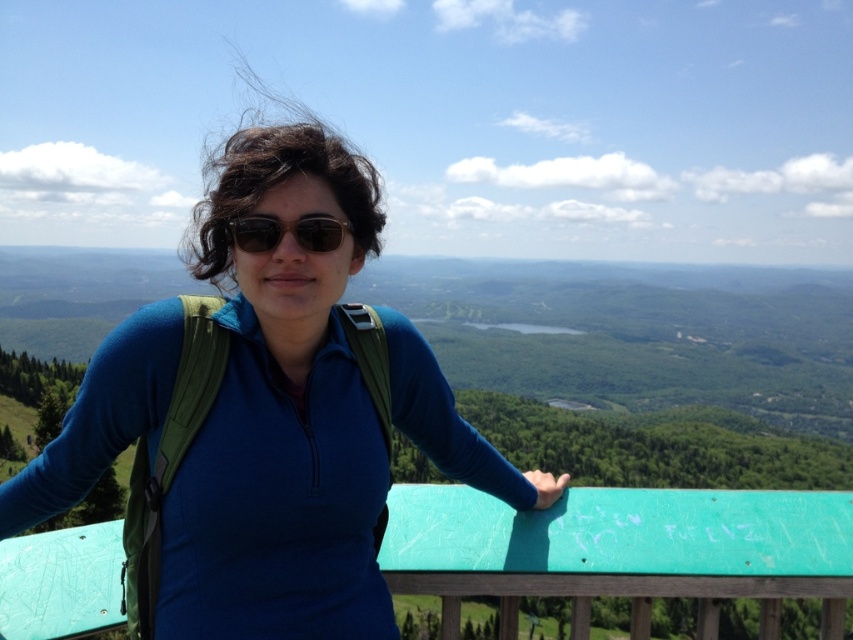
You are a photographer trying to capture the scenic overlook. You notice the blue fabric shirt at center and the black matte sunglasses at center. Which object is positioned closer to the camera lens?

The blue fabric shirt at center is closer to the viewer than the black matte sunglasses at center, so the blue fabric shirt at center would appear closer to the camera lens.